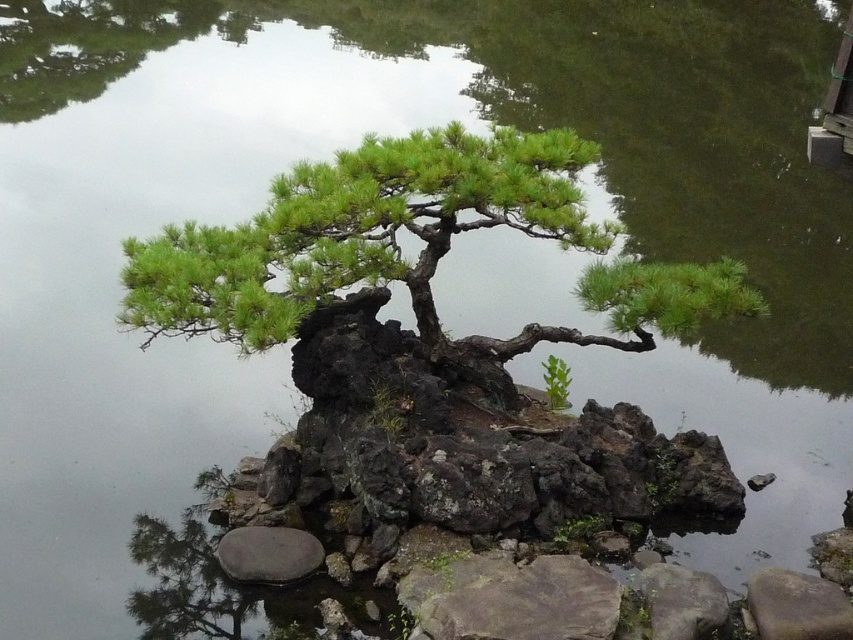
Question: Is green textured bonsai at center above gray rough rock at lower right?

Choices:
 (A) no
 (B) yes

Answer: (B)

Question: Does green textured bonsai at center have a larger size compared to gray rough rock at lower right?

Choices:
 (A) no
 (B) yes

Answer: (B)

Question: Does gray rough stone at center come in front of smooth gray stone at lower left?

Choices:
 (A) no
 (B) yes

Answer: (B)

Question: Estimate the real-world distances between objects in this image. Which object is closer to the gray rough rock at lower right?

Choices:
 (A) smooth gray stone at lower left
 (B) green textured bonsai at center
 (C) gray rough stone at lower right

Answer: (C)

Question: Which point is closer to the camera?

Choices:
 (A) gray rough stone at center
 (B) green textured bonsai at center

Answer: (B)

Question: Among these points, which one is farthest from the camera?

Choices:
 (A) (422, 605)
 (B) (781, 625)

Answer: (B)